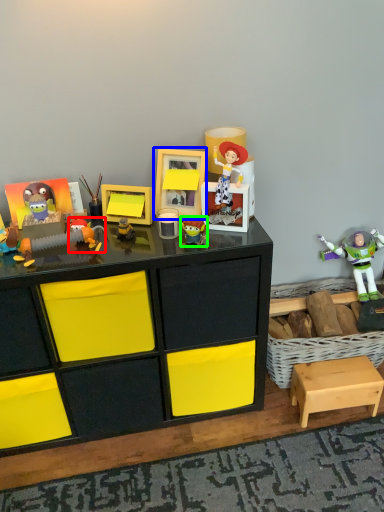
Question: Which is nearer to the toy (highlighted by a red box)? picture frame (highlighted by a blue box) or toy (highlighted by a green box).

Choices:
 (A) picture frame
 (B) toy

Answer: (A)